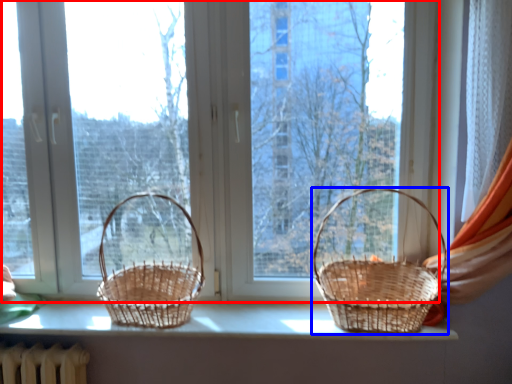
Question: Which object appears farthest to the camera in this image, window (highlighted by a red box) or picnic basket (highlighted by a blue box)?

Choices:
 (A) window
 (B) picnic basket

Answer: (A)